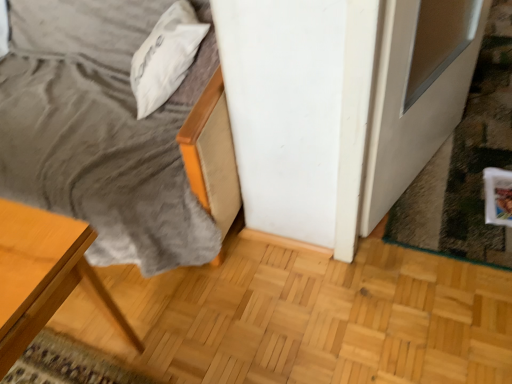
Question: From a real-world perspective, does white glossy screen door at lower right stand above white soft pillow at upper left?

Choices:
 (A) yes
 (B) no

Answer: (B)

Question: Is white glossy screen door at lower right positioned in front of white soft pillow at upper left?

Choices:
 (A) yes
 (B) no

Answer: (A)

Question: From the image's perspective, is white glossy screen door at lower right below white soft pillow at upper left?

Choices:
 (A) no
 (B) yes

Answer: (B)

Question: Considering the relative positions of white glossy screen door at lower right and white soft pillow at upper left in the image provided, is white glossy screen door at lower right to the left of white soft pillow at upper left from the viewer's perspective?

Choices:
 (A) no
 (B) yes

Answer: (A)

Question: Considering the relative sizes of white glossy screen door at lower right and white soft pillow at upper left in the image provided, is white glossy screen door at lower right smaller than white soft pillow at upper left?

Choices:
 (A) no
 (B) yes

Answer: (A)

Question: Is white glossy screen door at lower right facing away from white soft pillow at upper left?

Choices:
 (A) no
 (B) yes

Answer: (B)

Question: Considering the relative sizes of white soft pillow at upper left and white glossy screen door at lower right in the image provided, is white soft pillow at upper left bigger than white glossy screen door at lower right?

Choices:
 (A) yes
 (B) no

Answer: (B)

Question: From a real-world perspective, is white soft pillow at upper left beneath white glossy screen door at lower right?

Choices:
 (A) yes
 (B) no

Answer: (B)

Question: From a real-world perspective, is white soft pillow at upper left physically above white glossy screen door at lower right?

Choices:
 (A) no
 (B) yes

Answer: (B)

Question: Considering the relative positions of white soft pillow at upper left and white glossy screen door at lower right in the image provided, is white soft pillow at upper left behind white glossy screen door at lower right?

Choices:
 (A) no
 (B) yes

Answer: (B)

Question: Are white soft pillow at upper left and white glossy screen door at lower right located far from each other?

Choices:
 (A) no
 (B) yes

Answer: (A)

Question: Does white soft pillow at upper left have a lesser height compared to white glossy screen door at lower right?

Choices:
 (A) no
 (B) yes

Answer: (B)

Question: In terms of height, does white soft pillow at upper left look taller or shorter compared to white glossy screen door at lower right?

Choices:
 (A) short
 (B) tall

Answer: (A)